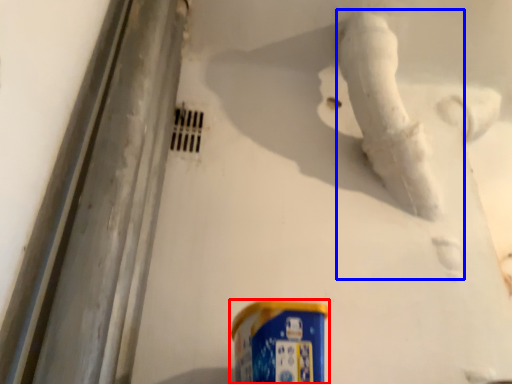
Question: Which object appears farthest to the camera in this image, spray can (highlighted by a red box) or water pipe (highlighted by a blue box)?

Choices:
 (A) spray can
 (B) water pipe

Answer: (B)